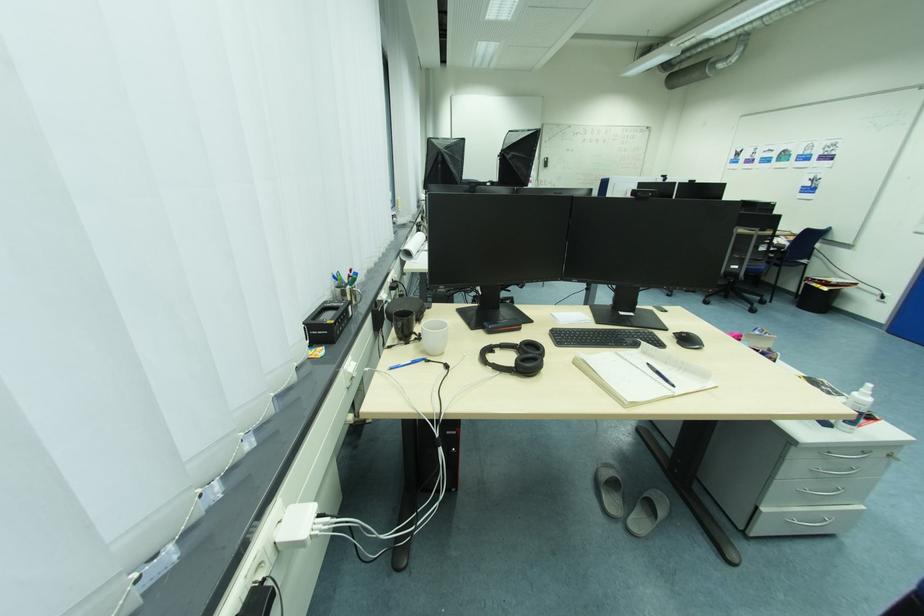
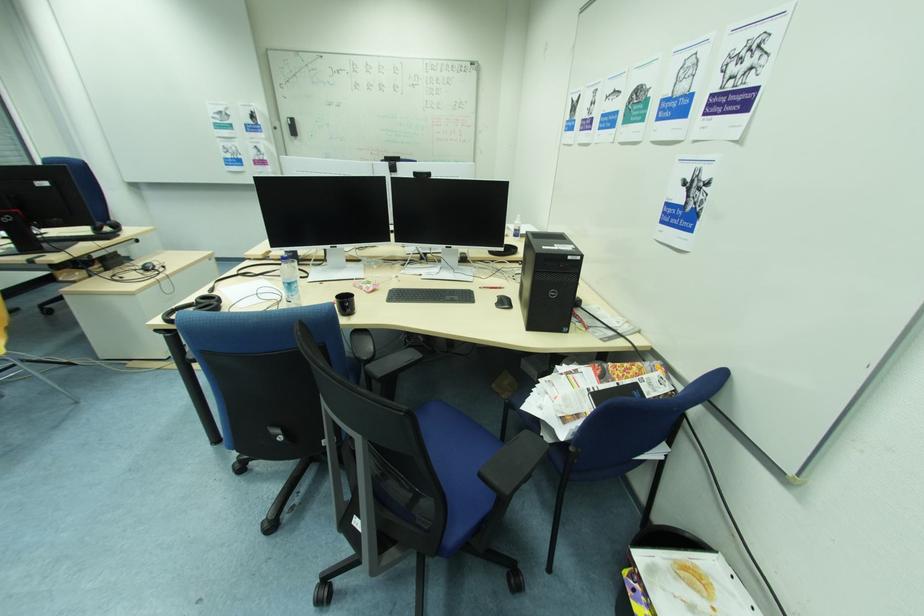
The point at (545, 160) is marked in the first image. Where is the corresponding point in the second image?

(286, 122)